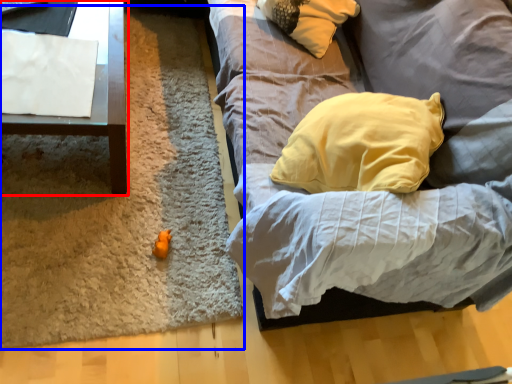
Question: Which object is closer to the camera taking this photo, furniture (highlighted by a red box) or mat (highlighted by a blue box)?

Choices:
 (A) furniture
 (B) mat

Answer: (A)